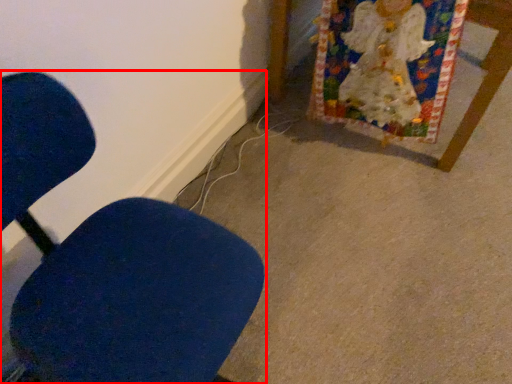
Question: From the image, what is the correct spatial relationship of chair (annotated by the red box) in relation to furniture?

Choices:
 (A) left
 (B) right

Answer: (A)